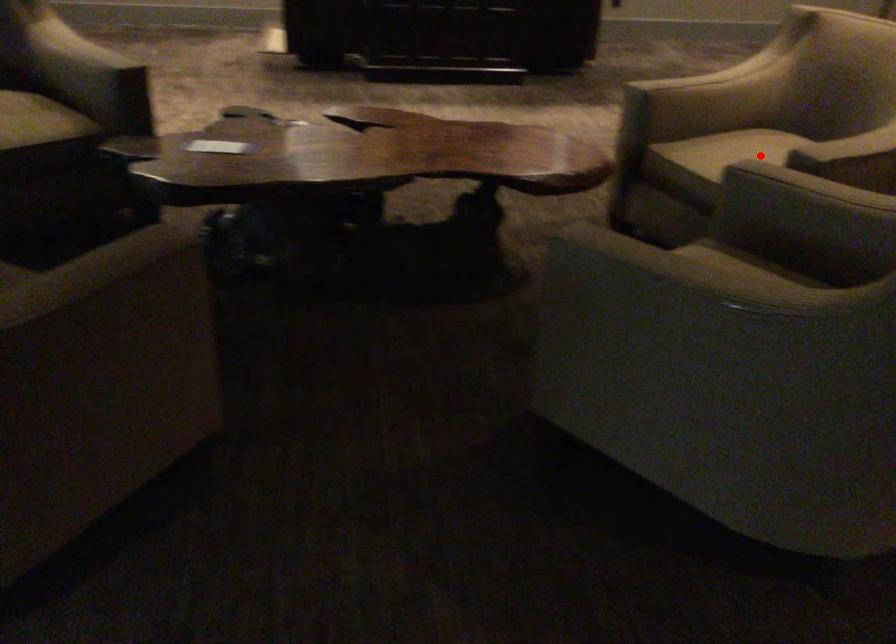
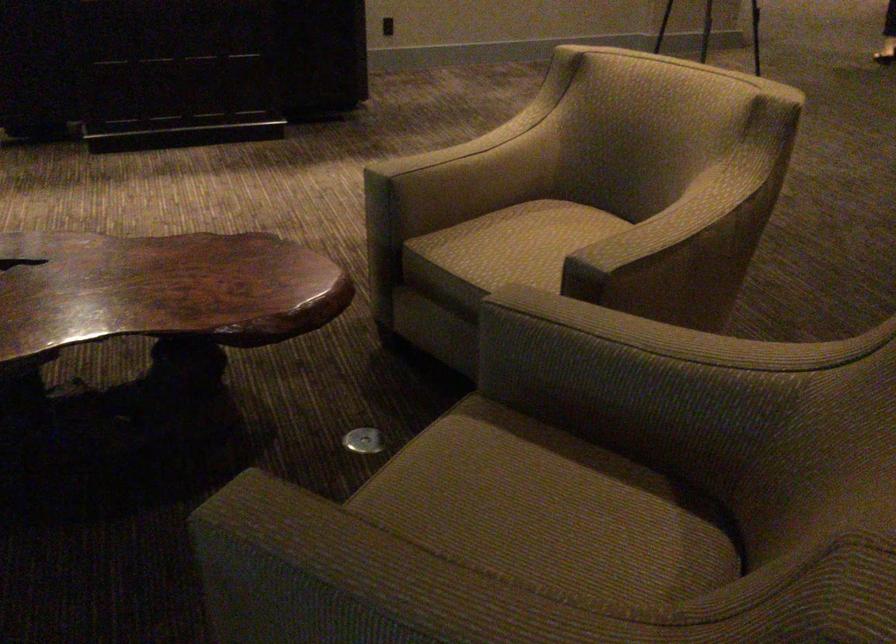
Where in the second image is the point corresponding to the highlighted location from the first image?

(535, 242)